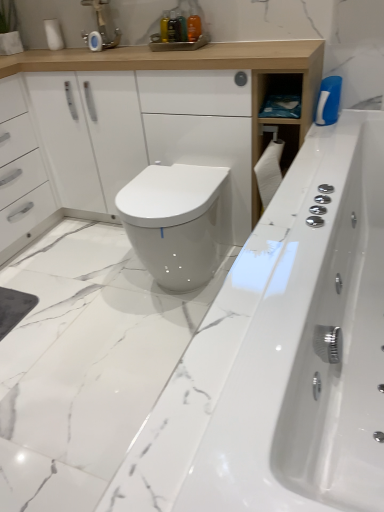
Locate an element on the screen. The image size is (384, 512). vacant space that is to the left of matte silver faucet at upper center is located at coordinates (67, 51).